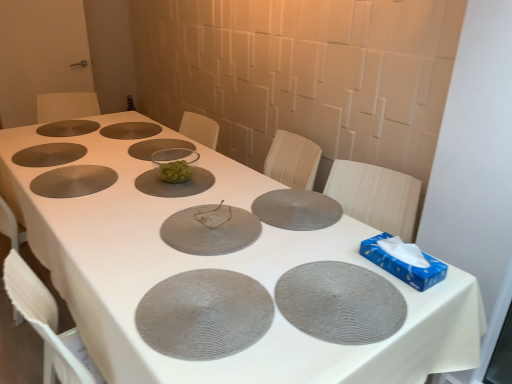
The width and height of the screenshot is (512, 384). Find the location of `vacant area situated to the left side of green glass bowl at center`. vacant area situated to the left side of green glass bowl at center is located at coordinates (123, 177).